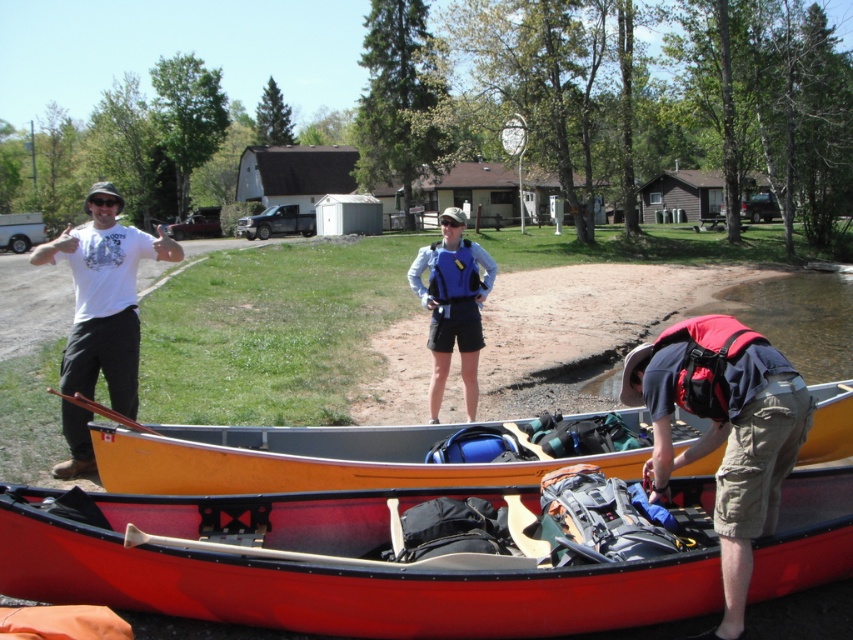
Is khaki cargo shorts at lower right positioned at the back of blue fabric life vest at center?

No.

Is khaki cargo shorts at lower right positioned before blue fabric life vest at center?

Yes, khaki cargo shorts at lower right is closer to the viewer.

This screenshot has width=853, height=640. Describe the element at coordinates (724, 432) in the screenshot. I see `khaki cargo shorts at lower right` at that location.

This screenshot has width=853, height=640. In order to click on khaki cargo shorts at lower right in this screenshot , I will do `click(724, 432)`.

Which is in front, point (424, 627) or point (351, 472)?

Point (424, 627)

Which is below, red plastic canoe at lower center or wooden canoe at center?

red plastic canoe at lower center is lower down.

Is point (334, 512) less distant than point (229, 435)?

Yes, it is.

Identify the location of red plastic canoe at lower center. (331, 566).

Does khaki cargo shorts at lower right have a smaller size compared to white t-shirt at left?

Yes, khaki cargo shorts at lower right is smaller than white t-shirt at left.

Can you confirm if khaki cargo shorts at lower right is bigger than white t-shirt at left?

No.

Is point (752, 436) farther from viewer compared to point (177, 246)?

No, it is in front of (177, 246).

I want to click on khaki cargo shorts at lower right, so click(x=724, y=432).